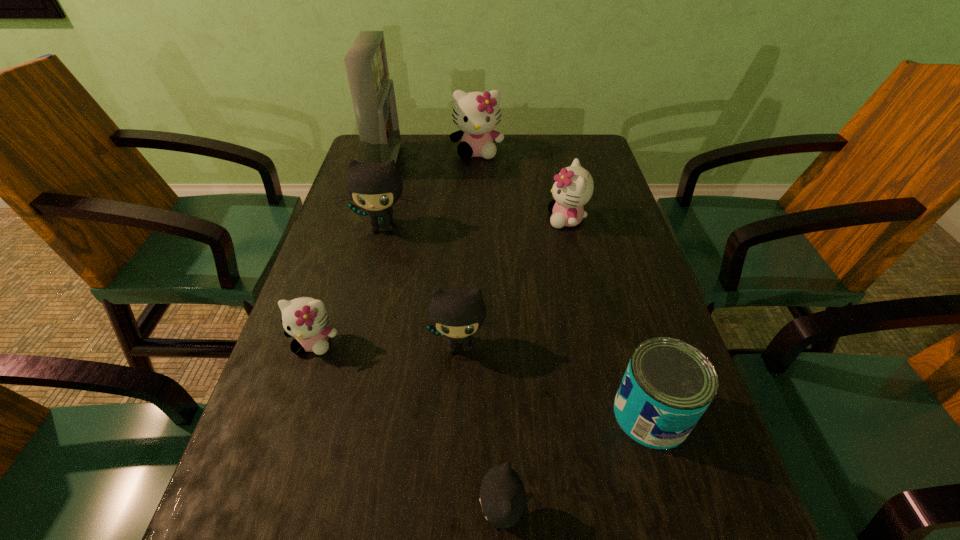
Locate an element on the screen. The width and height of the screenshot is (960, 540). free spot that satisfies the following two spatial constraints: 1. on the front-facing side of the biggest white kitten; 2. on the left side of the can is located at coordinates pyautogui.click(x=474, y=414).